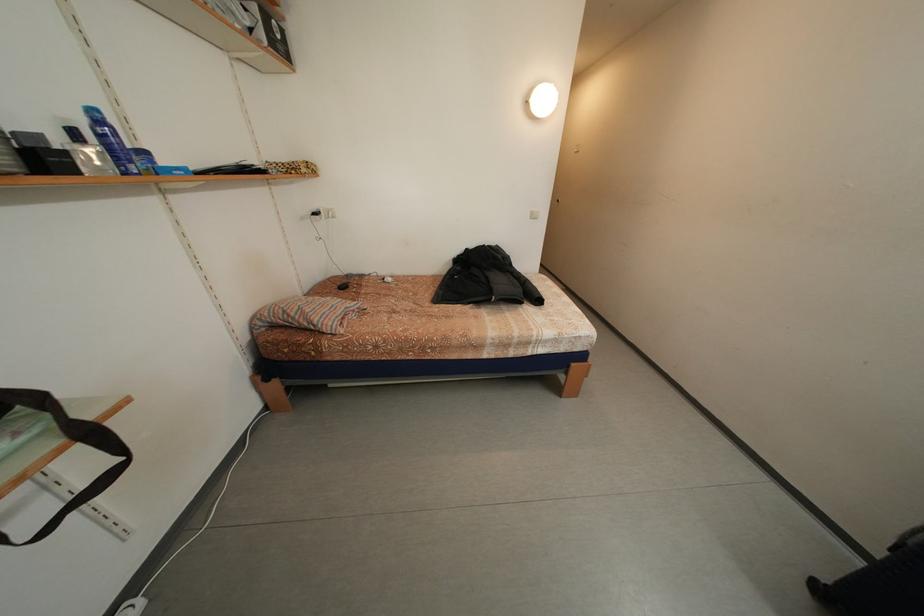
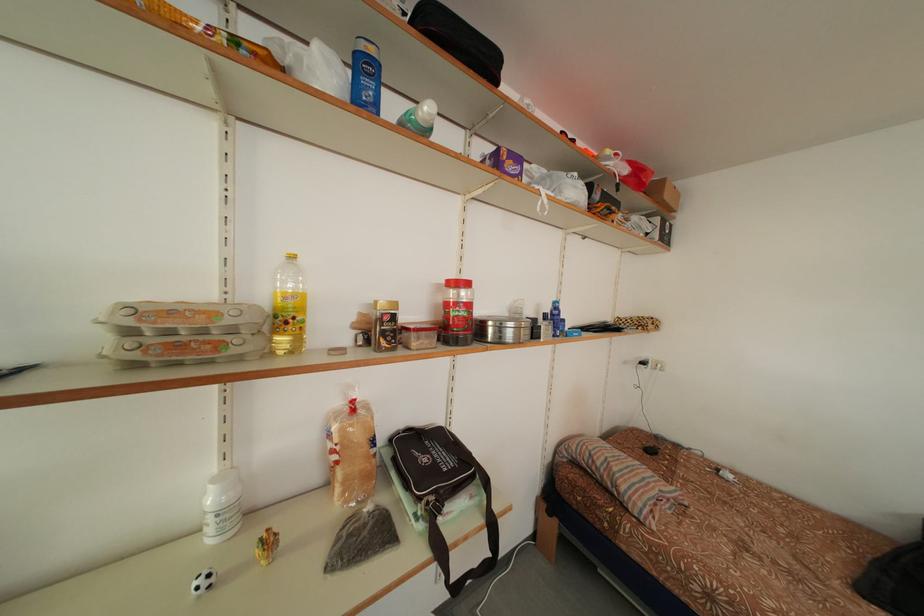
Question: The images are taken continuously from a first-person perspective. In which direction is your viewpoint rotating?

Choices:
 (A) Left
 (B) Right
 (C) Up
 (D) Down

Answer: (A)